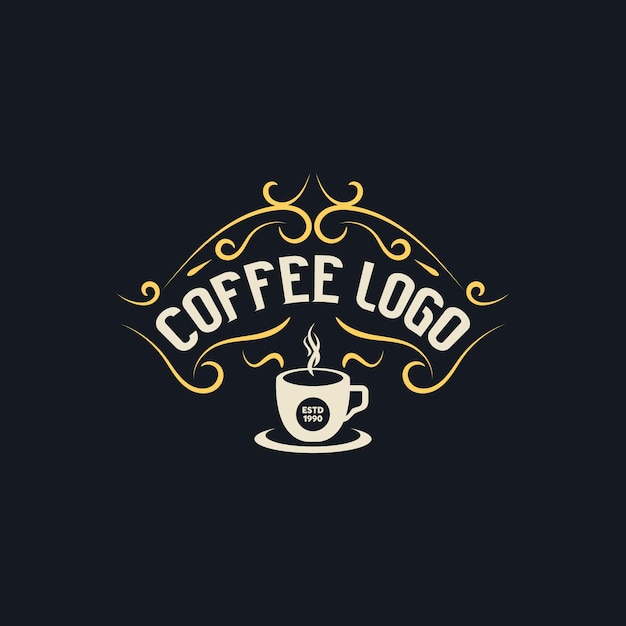
I want to click on coffee cup handle, right side of cup, so click(370, 411).